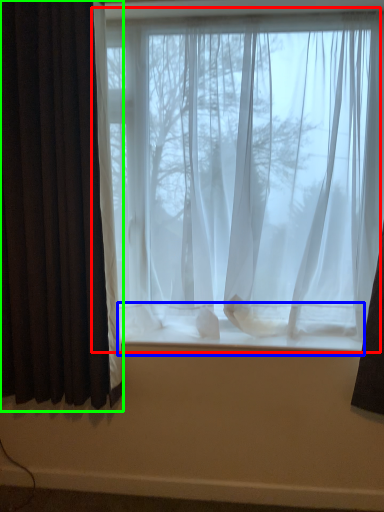
Question: Estimate the real-world distances between objects in this image. Which object is farther from window (highlighted by a red box), window sill (highlighted by a blue box) or curtain (highlighted by a green box)?

Choices:
 (A) window sill
 (B) curtain

Answer: (B)